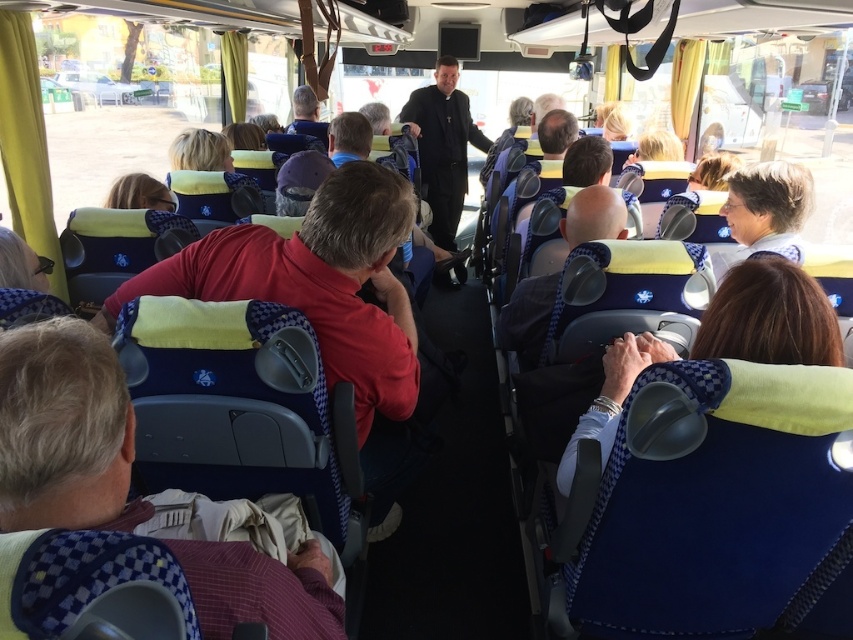
Question: Does maroon checkered shirt at lower left appear over black matte coat at center?

Choices:
 (A) yes
 (B) no

Answer: (B)

Question: Can you confirm if maroon checkered shirt at lower left is positioned below smooth blue shirt at center?

Choices:
 (A) yes
 (B) no

Answer: (A)

Question: Considering the real-world distances, which object is farthest from the maroon checkered shirt at lower left?

Choices:
 (A) smooth blue shirt at center
 (B) black matte coat at center
 (C) blue textured pillow at center

Answer: (B)

Question: Which point appears closest to the camera in this image?

Choices:
 (A) (618, 212)
 (B) (561, 460)
 (C) (430, 147)

Answer: (B)

Question: Considering the real-world distances, which object is closest to the maroon checkered shirt at lower left?

Choices:
 (A) smooth blue shirt at center
 (B) black matte coat at center

Answer: (A)

Question: Is maroon checkered shirt at lower left smaller than black matte coat at center?

Choices:
 (A) no
 (B) yes

Answer: (B)